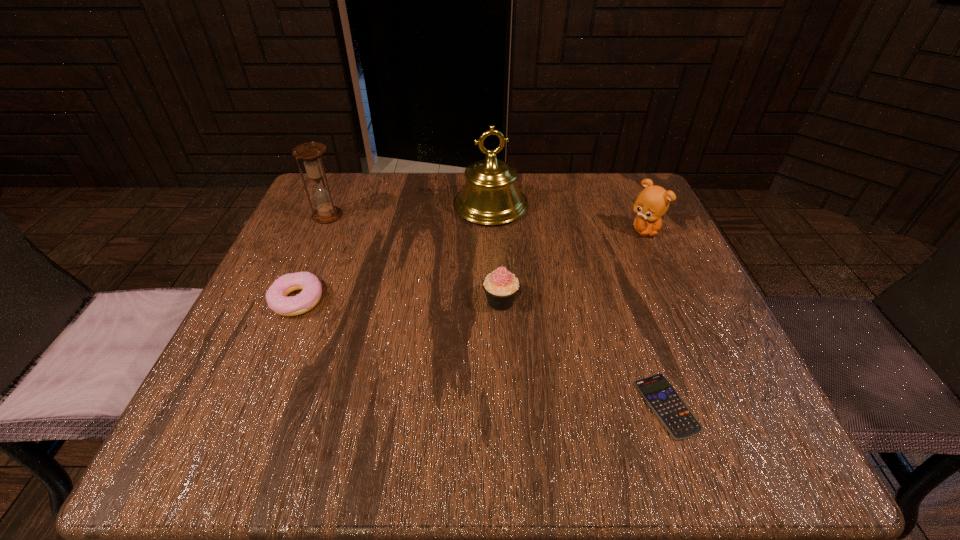
Find the location of `teddy bear situated at the right edge`. teddy bear situated at the right edge is located at coordinates click(652, 203).

In order to click on calculator located at the right edge in this screenshot , I will do `click(674, 414)`.

You are a GUI agent. You are given a task and a screenshot of the screen. Output one action in this format:
    pyautogui.click(x=<x>, y=<y>)
    Task: Click on the object positioned at the far left corner
    Image resolution: width=960 pixels, height=540 pixels.
    Given the screenshot: What is the action you would take?
    pyautogui.click(x=310, y=153)

Find the location of `object located at the far right corner`. object located at the far right corner is located at coordinates (652, 203).

Where is `object located at the near right corner`? This screenshot has width=960, height=540. object located at the near right corner is located at coordinates (674, 414).

In the image, there is a desktop. At what (x,y) coordinates should I click in order to perform the action: click on free space at the far edge. Please return your answer as a coordinate pair (x, y). The width and height of the screenshot is (960, 540). Looking at the image, I should click on (544, 174).

In the image, there is a desktop. Where is `vacant space at the near edge`? Image resolution: width=960 pixels, height=540 pixels. vacant space at the near edge is located at coordinates (536, 419).

This screenshot has height=540, width=960. In order to click on vacant space at the left edge in this screenshot , I will do `click(328, 300)`.

Locate an element on the screen. vacant point at the right edge is located at coordinates (713, 372).

Image resolution: width=960 pixels, height=540 pixels. Find the location of `free space at the far left corner`. free space at the far left corner is located at coordinates (311, 216).